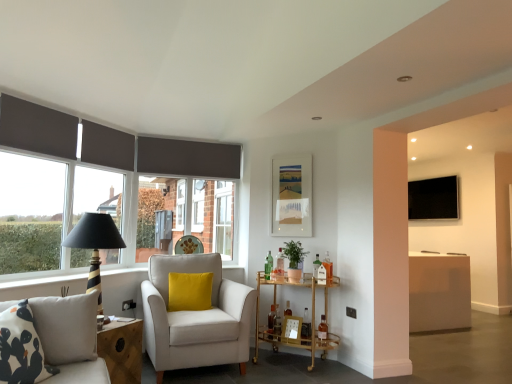
Question: Considering the positions of velvet yellow pillow at center and gold metallic bar cart at center in the image, is velvet yellow pillow at center wider or thinner than gold metallic bar cart at center?

Choices:
 (A) thin
 (B) wide

Answer: (A)

Question: Visually, is velvet yellow pillow at center positioned to the left or to the right of gold metallic bar cart at center?

Choices:
 (A) left
 (B) right

Answer: (A)

Question: Estimate the real-world distances between objects in this image. Which object is closer to the green glass bottle at center?

Choices:
 (A) matte white picture frame at upper center, the 1th picture frame from the top
 (B) wooden picture frame at lower center, the 2th picture frame viewed from the top
 (C) gold metallic bar cart at center
 (D) patterned fabric studio couch at lower left
 (E) velvet yellow pillow at center

Answer: (C)

Question: Estimate the real-world distances between objects in this image. Which object is closer to the wooden picture frame at lower center, which is the first picture frame in front-to-back order?

Choices:
 (A) black striped table lamp at left
 (B) green glass bottle at center
 (C) gold metallic bar cart at center
 (D) matte black lampshade at left
 (E) white fabric armchair with yellow cushion at center

Answer: (C)